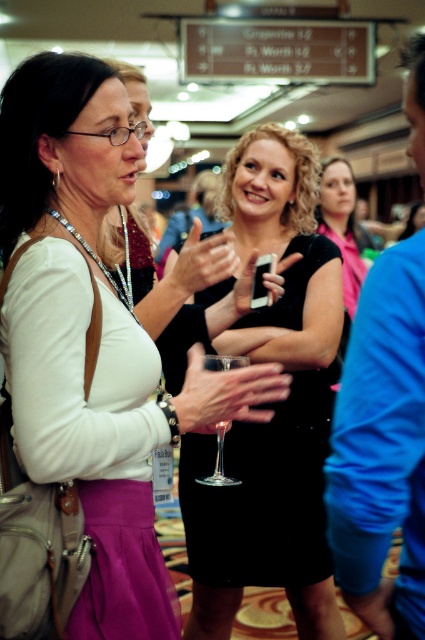
Question: Estimate the real-world distances between objects in this image. Which object is closer to the white matte dress at center?

Choices:
 (A) black matte dress at center
 (B) black satin dress at center

Answer: (B)

Question: Can you confirm if white matte dress at center is positioned to the right of black matte dress at center?

Choices:
 (A) no
 (B) yes

Answer: (A)

Question: Which is farther from the black matte dress at center?

Choices:
 (A) clear glass wine glass at center
 (B) white matte dress at center
 (C) black satin dress at center

Answer: (B)

Question: Can you confirm if black satin dress at center is thinner than clear glass wine glass at center?

Choices:
 (A) no
 (B) yes

Answer: (A)

Question: Which object is closer to the camera taking this photo?

Choices:
 (A) black satin dress at center
 (B) clear glass wine glass at center
 (C) white matte dress at center

Answer: (C)

Question: Does white matte dress at center lie in front of black matte dress at center?

Choices:
 (A) yes
 (B) no

Answer: (A)